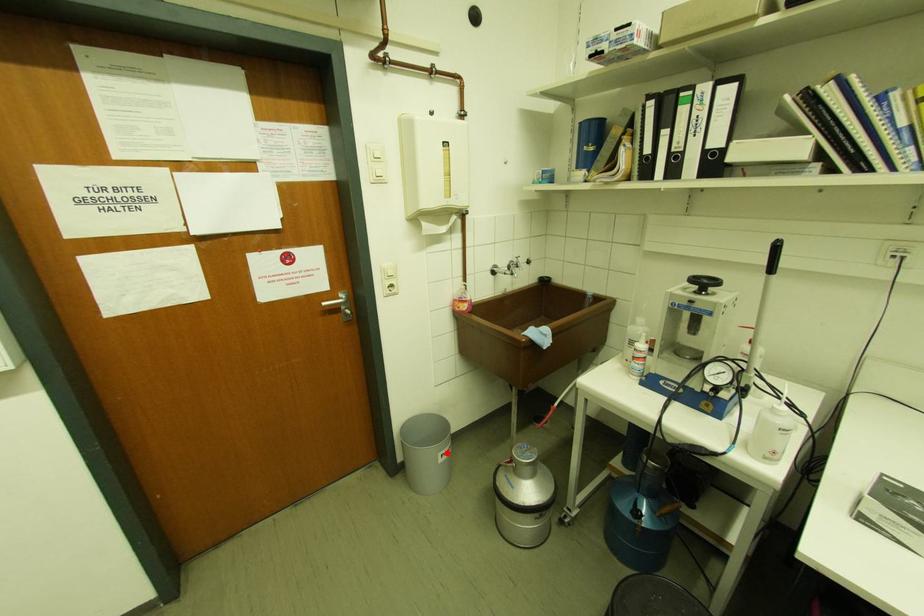
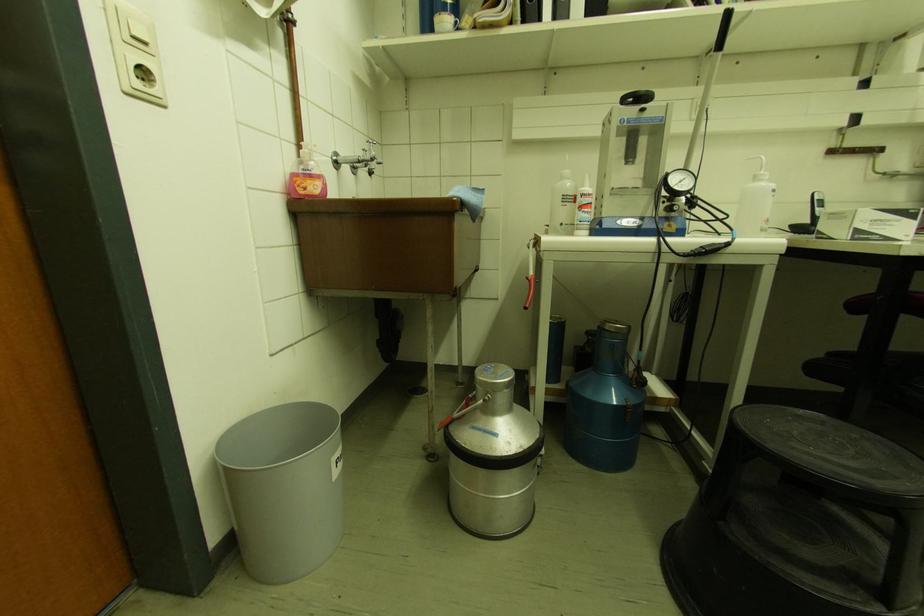
Question: I am providing you with two images of the same scene from different viewpoints. In image1, a red point is highlighted. Considering the same 3D point in image2, which of the following is correct?

Choices:
 (A) It is closer
 (B) It is farther

Answer: (B)